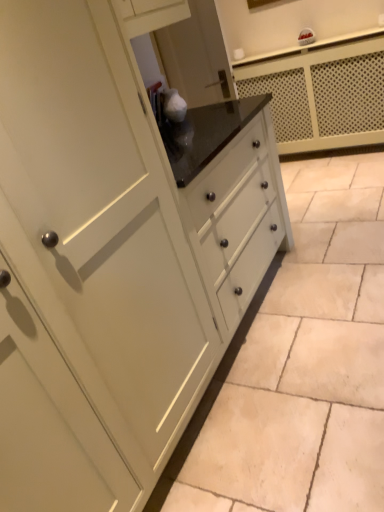
Question: Choose the correct answer: Is matte white cabinet at center inside white glossy counter at upper center or outside it?

Choices:
 (A) outside
 (B) inside

Answer: (A)

Question: Is matte white cabinet at center bigger or smaller than white glossy counter at upper center?

Choices:
 (A) big
 (B) small

Answer: (B)

Question: In terms of width, does matte white cabinet at center look wider or thinner when compared to white glossy counter at upper center?

Choices:
 (A) wide
 (B) thin

Answer: (A)

Question: Is point (284, 96) positioned closer to the camera than point (352, 465)?

Choices:
 (A) closer
 (B) farther

Answer: (B)

Question: Looking at their shapes, would you say white glossy counter at upper center is wider or thinner than matte white cabinet at center?

Choices:
 (A) thin
 (B) wide

Answer: (A)

Question: From a real-world perspective, is white glossy counter at upper center positioned above or below matte white cabinet at center?

Choices:
 (A) above
 (B) below

Answer: (A)

Question: In the image, is white glossy counter at upper center positioned in front of or behind matte white cabinet at center?

Choices:
 (A) front
 (B) behind

Answer: (B)